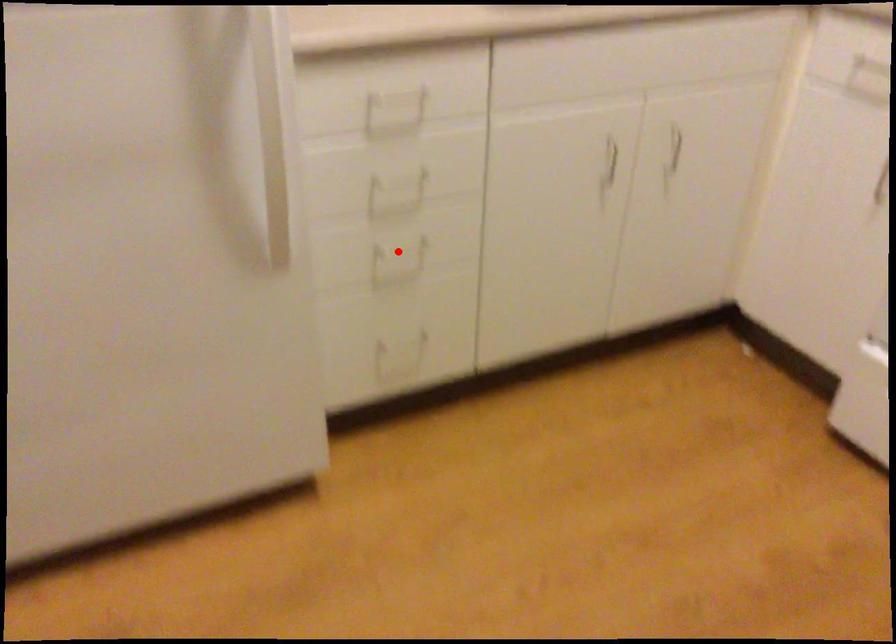
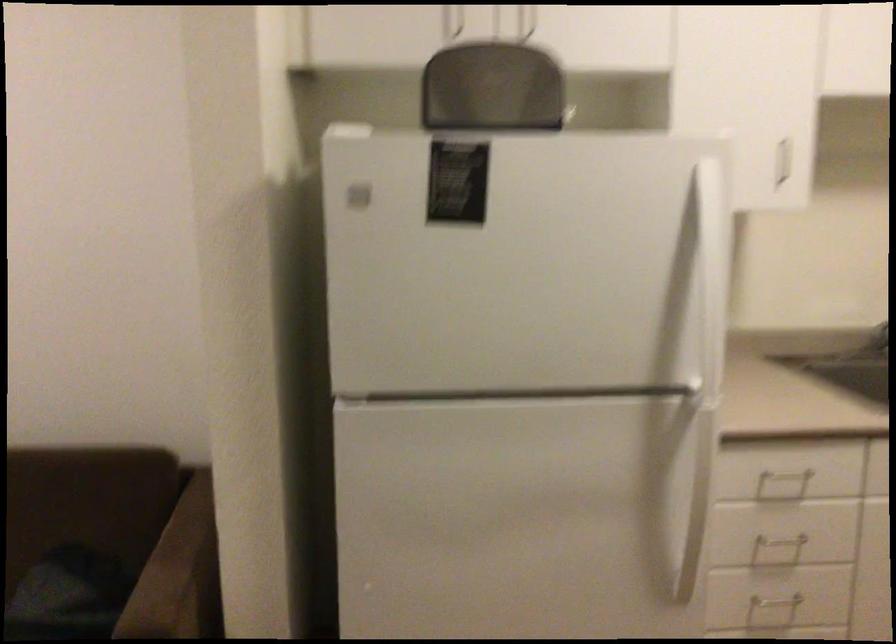
Find the pixel in the second image that matches the highlighted location in the first image.

(773, 608)